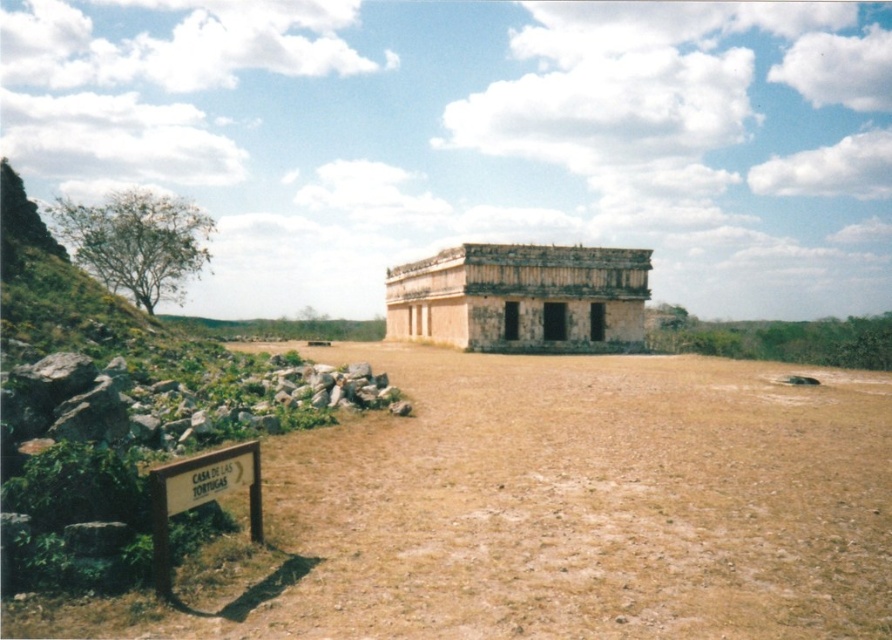
Question: Estimate the real-world distances between objects in this image. Which object is closer to the gray rock pile at lower left?

Choices:
 (A) beige stone ruins at center
 (B) brown sandy dirt field at center

Answer: (B)

Question: Among these points, which one is farthest from the camera?

Choices:
 (A) (75, 552)
 (B) (442, 557)
 (C) (560, 349)
 (D) (180, 419)

Answer: (C)

Question: Which point is farther to the camera?

Choices:
 (A) (113, 532)
 (B) (391, 292)

Answer: (B)

Question: Does gray rock pile at lower left have a greater width compared to brown stone at lower left?

Choices:
 (A) no
 (B) yes

Answer: (B)

Question: From the image, what is the correct spatial relationship of brown sandy dirt field at center in relation to gray rock pile at lower left?

Choices:
 (A) above
 (B) below

Answer: (B)

Question: Does beige stone ruins at center come behind gray rock pile at lower left?

Choices:
 (A) yes
 (B) no

Answer: (A)